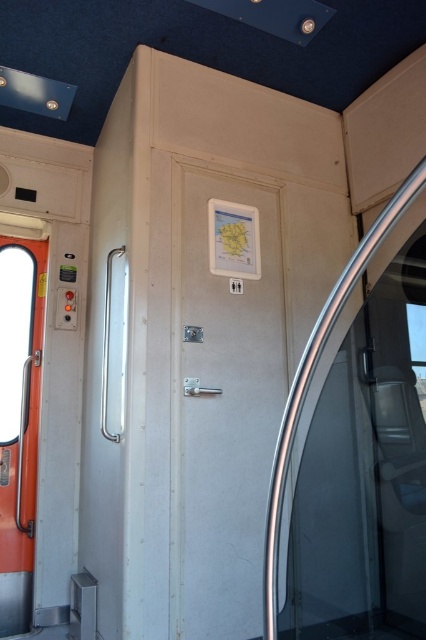
Question: Among these points, which one is farthest from the camera?

Choices:
 (A) (201, 512)
 (B) (5, 406)

Answer: (B)

Question: Which object is the closest to the transparent glass door at right?

Choices:
 (A) orange glossy screen door at left
 (B) white matte door at center

Answer: (B)

Question: Where is white matte door at center located in relation to orange glossy screen door at left in the image?

Choices:
 (A) left
 (B) right

Answer: (B)

Question: Considering the real-world distances, which object is closest to the transparent glass door at right?

Choices:
 (A) orange glossy screen door at left
 (B) white matte door at center

Answer: (B)

Question: Does white matte door at center appear under orange glossy screen door at left?

Choices:
 (A) yes
 (B) no

Answer: (B)

Question: Is white matte door at center smaller than orange glossy screen door at left?

Choices:
 (A) no
 (B) yes

Answer: (A)